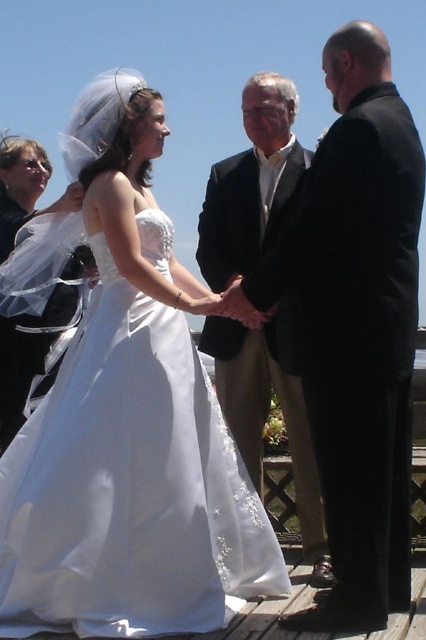
Question: Is satin black suit at center positioned before translucent satin veil at upper left?

Choices:
 (A) yes
 (B) no

Answer: (A)

Question: Which object is positioned farthest from the translucent satin veil at upper left?

Choices:
 (A) light beige cotton suit at center
 (B) white satin dress at center

Answer: (A)

Question: Which is farther from the translucent satin veil at upper left?

Choices:
 (A) light beige cotton suit at center
 (B) white satin dress at center
 (C) satin black suit at center

Answer: (A)

Question: Does white satin dress at center appear on the right side of light beige cotton suit at center?

Choices:
 (A) yes
 (B) no

Answer: (B)

Question: Is white satin dress at center positioned before translucent satin veil at upper left?

Choices:
 (A) yes
 (B) no

Answer: (A)

Question: Which object is farther from the camera taking this photo?

Choices:
 (A) white satin dress at center
 (B) light beige cotton suit at center
 (C) satin black suit at center
 (D) translucent satin veil at upper left

Answer: (D)